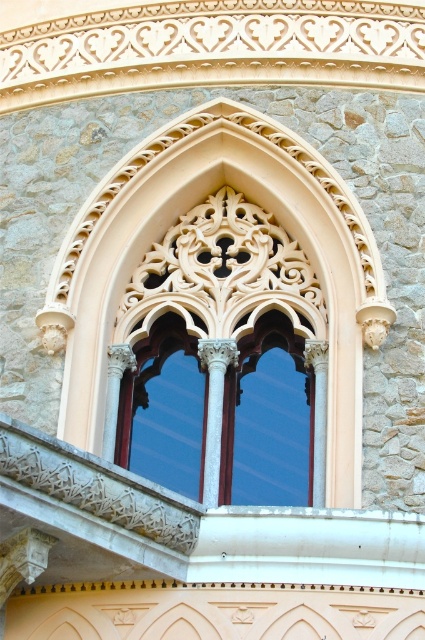
Between white stone window at center and matte glass window at center, which one appears on the right side from the viewer's perspective?

From the viewer's perspective, white stone window at center appears more on the right side.

Does white stone window at center have a lesser height compared to matte glass window at center?

No, white stone window at center is not shorter than matte glass window at center.

Is point (209, 372) farther from camera compared to point (144, 387)?

No, (209, 372) is closer to viewer.

You are a GUI agent. You are given a task and a screenshot of the screen. Output one action in this format:
    pyautogui.click(x=<x>, y=<y>)
    Task: Click on the white stone window at center
    Image resolution: width=425 pixels, height=640 pixels.
    Given the screenshot: What is the action you would take?
    pyautogui.click(x=226, y=358)